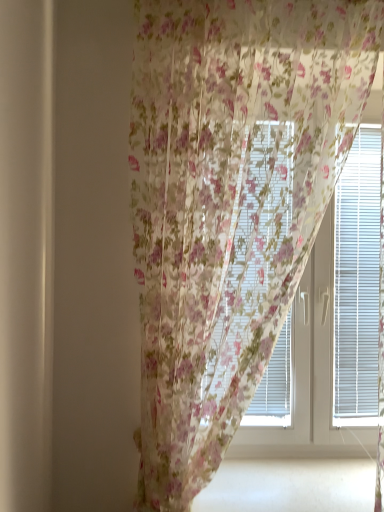
Question: Does translucent floral curtain at center contain floral sheer curtain at center?

Choices:
 (A) no
 (B) yes

Answer: (A)

Question: From the image's perspective, is translucent floral curtain at center below floral sheer curtain at center?

Choices:
 (A) yes
 (B) no

Answer: (A)

Question: Is translucent floral curtain at center at the right side of floral sheer curtain at center?

Choices:
 (A) yes
 (B) no

Answer: (A)

Question: Is translucent floral curtain at center turned away from floral sheer curtain at center?

Choices:
 (A) yes
 (B) no

Answer: (B)

Question: Can you confirm if translucent floral curtain at center is smaller than floral sheer curtain at center?

Choices:
 (A) no
 (B) yes

Answer: (B)

Question: Can you see translucent floral curtain at center touching floral sheer curtain at center?

Choices:
 (A) no
 (B) yes

Answer: (A)

Question: From a real-world perspective, is floral sheer curtain at center located higher than translucent floral curtain at center?

Choices:
 (A) no
 (B) yes

Answer: (B)

Question: From the image's perspective, is floral sheer curtain at center on top of translucent floral curtain at center?

Choices:
 (A) yes
 (B) no

Answer: (A)

Question: From the image's perspective, is floral sheer curtain at center below translucent floral curtain at center?

Choices:
 (A) yes
 (B) no

Answer: (B)

Question: Is floral sheer curtain at center far from translucent floral curtain at center?

Choices:
 (A) no
 (B) yes

Answer: (A)

Question: Is floral sheer curtain at center taller than translucent floral curtain at center?

Choices:
 (A) yes
 (B) no

Answer: (A)

Question: Does floral sheer curtain at center lie behind translucent floral curtain at center?

Choices:
 (A) no
 (B) yes

Answer: (A)

Question: From a real-world perspective, is floral sheer curtain at center positioned above or below translucent floral curtain at center?

Choices:
 (A) above
 (B) below

Answer: (A)